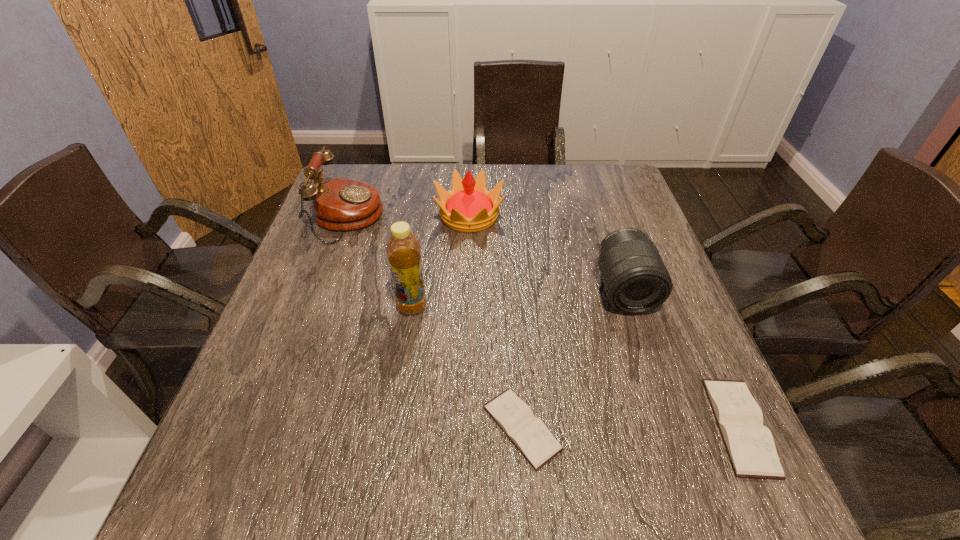
Please show where to add a diary on the left while keeping spacing even. Please provide its 2D coordinates. Your answer should be formatted as a tuple, i.e. [(x, y)], where the tuple contains the x and y coordinates of a point satisfying the conditions above.

[(302, 429)]